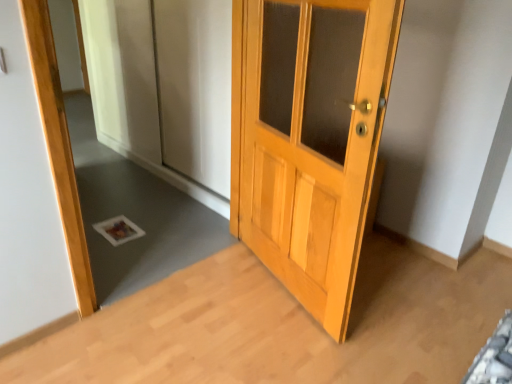
Question: From a real-world perspective, does white glossy mirror at lower left sit lower than light brown wooden door at center?

Choices:
 (A) no
 (B) yes

Answer: (B)

Question: Is white glossy mirror at lower left to the right of light brown wooden door at center from the viewer's perspective?

Choices:
 (A) no
 (B) yes

Answer: (A)

Question: Is white glossy mirror at lower left positioned in front of light brown wooden door at center?

Choices:
 (A) no
 (B) yes

Answer: (A)

Question: Does white glossy mirror at lower left contain light brown wooden door at center?

Choices:
 (A) no
 (B) yes

Answer: (A)

Question: Does white glossy mirror at lower left have a greater width compared to light brown wooden door at center?

Choices:
 (A) yes
 (B) no

Answer: (B)

Question: Is white glossy mirror at lower left thinner than light brown wooden door at center?

Choices:
 (A) no
 (B) yes

Answer: (B)

Question: Is light brown wooden door at center directly adjacent to white glossy mirror at lower left?

Choices:
 (A) no
 (B) yes

Answer: (A)

Question: Can you confirm if light brown wooden door at center is taller than white glossy mirror at lower left?

Choices:
 (A) yes
 (B) no

Answer: (A)

Question: From a real-world perspective, is light brown wooden door at center below white glossy mirror at lower left?

Choices:
 (A) yes
 (B) no

Answer: (B)

Question: Is light brown wooden door at center looking in the opposite direction of white glossy mirror at lower left?

Choices:
 (A) no
 (B) yes

Answer: (A)

Question: Would you consider light brown wooden door at center to be distant from white glossy mirror at lower left?

Choices:
 (A) no
 (B) yes

Answer: (A)

Question: Can we say light brown wooden door at center lies outside white glossy mirror at lower left?

Choices:
 (A) no
 (B) yes

Answer: (B)

Question: Does point (128, 59) appear closer or farther from the camera than point (247, 213)?

Choices:
 (A) farther
 (B) closer

Answer: (A)